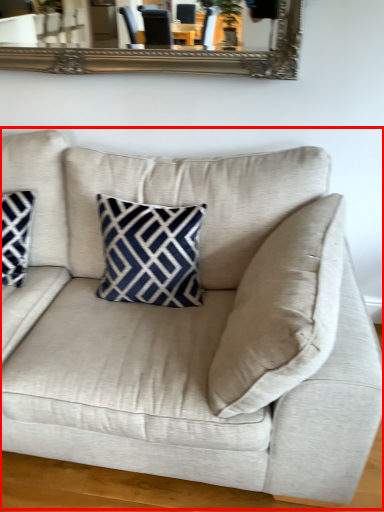
Question: From the image, what is the correct spatial relationship of studio couch (annotated by the red box) in relation to pillow?

Choices:
 (A) left
 (B) right

Answer: (B)